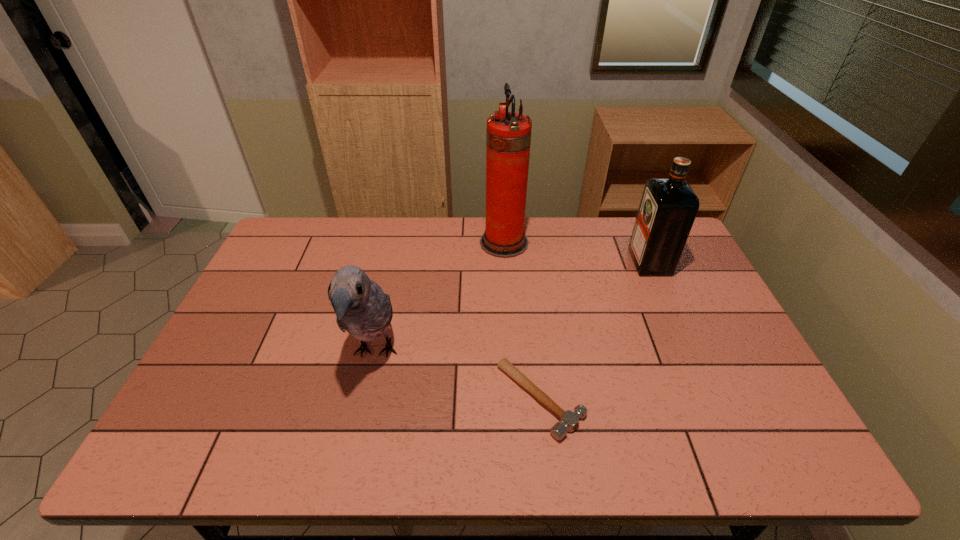
Identify the location of vacant space at the far left corner of the desktop. The height and width of the screenshot is (540, 960). (293, 237).

In the image, there is a desktop. Where is `free space at the near left corner`? This screenshot has width=960, height=540. free space at the near left corner is located at coordinates tap(186, 442).

Where is `free space between the liquor and the shortest object`? Image resolution: width=960 pixels, height=540 pixels. free space between the liquor and the shortest object is located at coordinates (595, 331).

What are the coordinates of `vacant area between the hammer and the rightmost object` in the screenshot? It's located at (595, 331).

Locate an element on the screen. The width and height of the screenshot is (960, 540). free spot between the liquor and the parrot is located at coordinates (513, 308).

Find the location of a particular element. The width and height of the screenshot is (960, 540). free space between the fire extinguisher and the rightmost object is located at coordinates (577, 252).

In order to click on vacant area that lies between the liquor and the tallest object in this screenshot , I will do `click(577, 252)`.

Identify the location of free area in between the shortest object and the liquor. (595, 331).

This screenshot has width=960, height=540. What are the coordinates of `blank region between the fire extinguisher and the rightmost object` in the screenshot? It's located at (577, 252).

You are a GUI agent. You are given a task and a screenshot of the screen. Output one action in this format:
    pyautogui.click(x=<x>, y=<y>)
    Task: Click on the vacant region between the rightmost object and the shortest object
    The height and width of the screenshot is (540, 960).
    Given the screenshot: What is the action you would take?
    pyautogui.click(x=595, y=331)